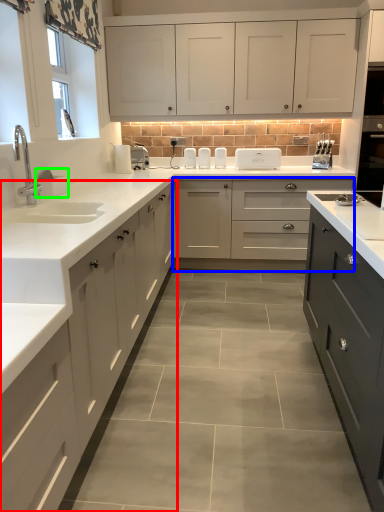
Question: Considering the real-world distances, which object is farthest from cabinetry (highlighted by a red box)? cabinetry (highlighted by a blue box) or appliance (highlighted by a green box)?

Choices:
 (A) cabinetry
 (B) appliance

Answer: (A)